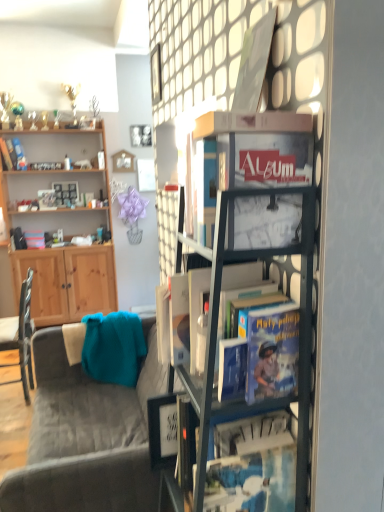
Question: Can you confirm if hardcover book at left, which is counted as the first book, starting from the back, is positioned to the left of matte white picture frame at upper center, the 1th picture frame from the back?

Choices:
 (A) yes
 (B) no

Answer: (A)

Question: Does hardcover book at left, which is counted as the first book, starting from the back, contain matte white picture frame at upper center, the 1th picture frame from the back?

Choices:
 (A) no
 (B) yes

Answer: (A)

Question: Is hardcover book at left, which is counted as the first book, starting from the back, shorter than matte white picture frame at upper center, the 5th picture frame when ordered from front to back?

Choices:
 (A) no
 (B) yes

Answer: (B)

Question: From a real-world perspective, is hardcover book at left, the first book viewed from the left, over matte white picture frame at upper center, the 5th picture frame when ordered from front to back?

Choices:
 (A) no
 (B) yes

Answer: (B)

Question: Is hardcover book at left, the 1th book when ordered from top to bottom, turned away from matte white picture frame at upper center, the 1th picture frame from the back?

Choices:
 (A) no
 (B) yes

Answer: (A)

Question: Does hardcover book at left, which is counted as the first book, starting from the back, have a smaller size compared to matte white picture frame at upper center, the 3th picture frame when ordered from left to right?

Choices:
 (A) yes
 (B) no

Answer: (B)

Question: Considering the relative sizes of metallic black easel at upper center and matte glass picture frame at upper center, which ranks as the fifth picture frame in back-to-front order, in the image provided, is metallic black easel at upper center wider than matte glass picture frame at upper center, which ranks as the fifth picture frame in back-to-front order,?

Choices:
 (A) yes
 (B) no

Answer: (A)

Question: Can you confirm if metallic black easel at upper center is shorter than matte glass picture frame at upper center, placed as the fifth picture frame when sorted from left to right?

Choices:
 (A) no
 (B) yes

Answer: (A)

Question: Can you confirm if metallic black easel at upper center is thinner than matte glass picture frame at upper center, which ranks as the fifth picture frame in back-to-front order?

Choices:
 (A) yes
 (B) no

Answer: (B)

Question: Is matte glass picture frame at upper center, which ranks as the fifth picture frame in back-to-front order, surrounded by metallic black easel at upper center?

Choices:
 (A) no
 (B) yes

Answer: (A)

Question: From a real-world perspective, is metallic black easel at upper center over matte glass picture frame at upper center, the 1th picture frame positioned from the right?

Choices:
 (A) yes
 (B) no

Answer: (B)

Question: Could you tell me if metallic black easel at upper center is turned towards matte glass picture frame at upper center, the 1th picture frame positioned from the right?

Choices:
 (A) yes
 (B) no

Answer: (A)

Question: From the image's perspective, is wooden cabinet at left under velvet grey couch at lower left?

Choices:
 (A) no
 (B) yes

Answer: (A)